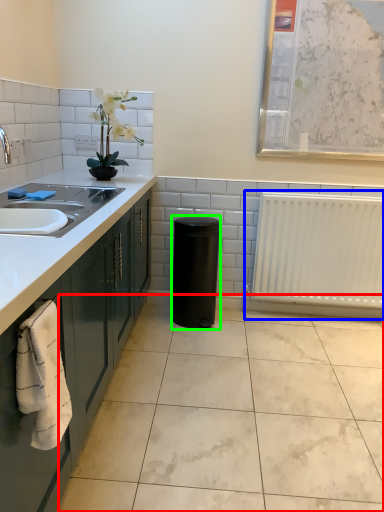
Question: Which object is the closest to the ceramic tile (highlighted by a red box)? Choose among these: radiator (highlighted by a blue box) or appliance (highlighted by a green box).

Choices:
 (A) radiator
 (B) appliance

Answer: (B)